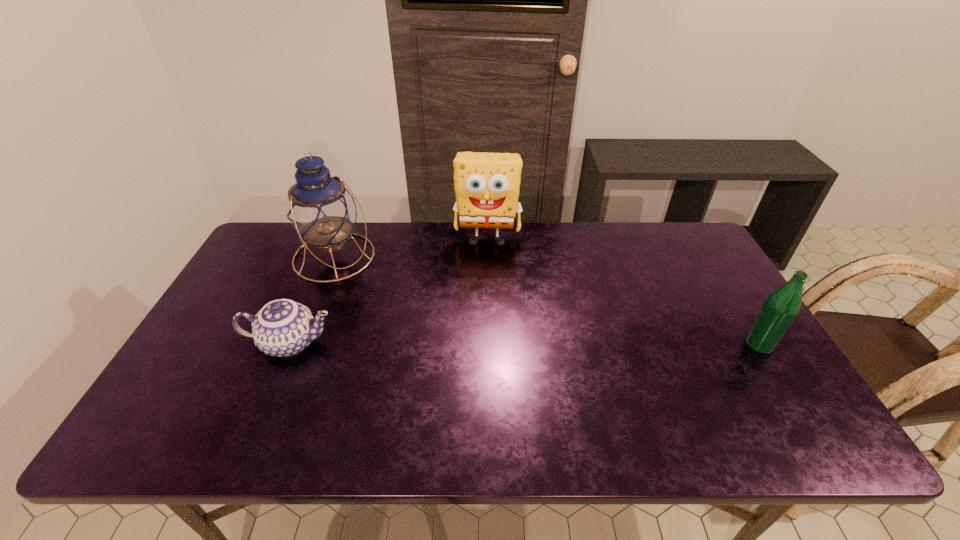
Where is `chinaware`? The height and width of the screenshot is (540, 960). chinaware is located at coordinates (283, 327).

At what (x,y) coordinates should I click in order to perform the action: click on the second shortest object. Please return your answer as a coordinate pair (x, y). This screenshot has height=540, width=960. Looking at the image, I should click on (780, 309).

Identify the location of bottle. (780, 309).

Find the location of a particular element. The height and width of the screenshot is (540, 960). the second tallest object is located at coordinates (487, 185).

Locate an element on the screen. Image resolution: width=960 pixels, height=540 pixels. the third object from left to right is located at coordinates (487, 185).

This screenshot has width=960, height=540. What are the coordinates of `lantern` in the screenshot? It's located at (320, 209).

Find the location of a particular element. Image resolution: width=960 pixels, height=540 pixels. free space located from the spout of the shortest object is located at coordinates (470, 343).

Locate an element on the screen. Image resolution: width=960 pixels, height=540 pixels. vacant position located on the back of the bottle is located at coordinates (716, 275).

I want to click on free space located on the face of the third shortest object, so click(486, 273).

Identify the location of free space located on the face of the third shortest object. This screenshot has width=960, height=540. [483, 328].